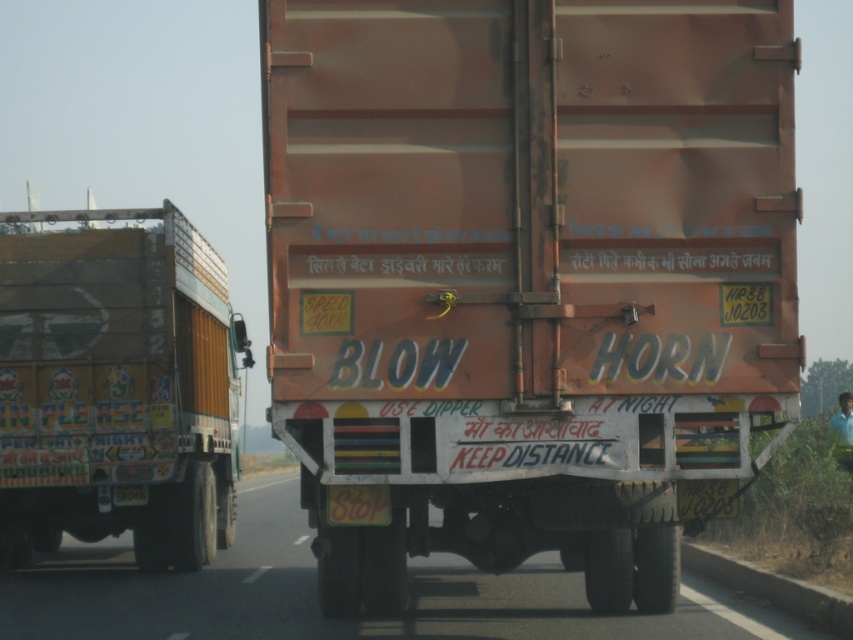
Can you confirm if painted wooden truck at left is bigger than orange matte truck at center?

No, painted wooden truck at left is not bigger than orange matte truck at center.

Consider the image. Can you confirm if painted wooden truck at left is positioned above orange matte truck at center?

Yes.

Locate an element on the screen. The height and width of the screenshot is (640, 853). painted wooden truck at left is located at coordinates (117, 387).

Looking at this image, between orange matte trailer truck at center and painted wooden truck at left, which one has less height?

With less height is painted wooden truck at left.

Which is more to the left, orange matte trailer truck at center or painted wooden truck at left?

From the viewer's perspective, painted wooden truck at left appears more on the left side.

Image resolution: width=853 pixels, height=640 pixels. Identify the location of orange matte trailer truck at center. (527, 278).

In order to click on orange matte trailer truck at center in this screenshot , I will do `click(527, 278)`.

Locate an element on the screen. orange matte trailer truck at center is located at coordinates [x=527, y=278].

The height and width of the screenshot is (640, 853). In order to click on orange matte trailer truck at center in this screenshot , I will do `click(527, 278)`.